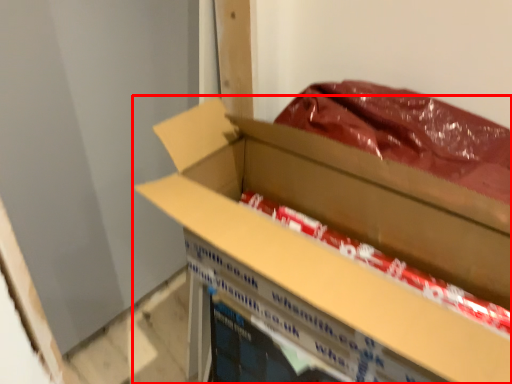
Question: Considering the relative positions of box (annotated by the red box) and wrapping paper in the image provided, where is box (annotated by the red box) located with respect to the staircase?

Choices:
 (A) left
 (B) right

Answer: (A)